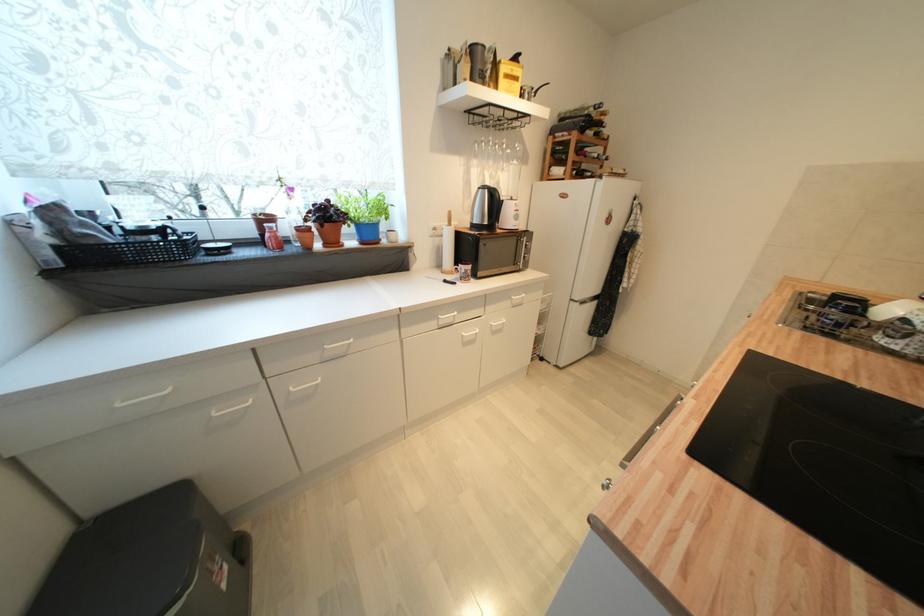
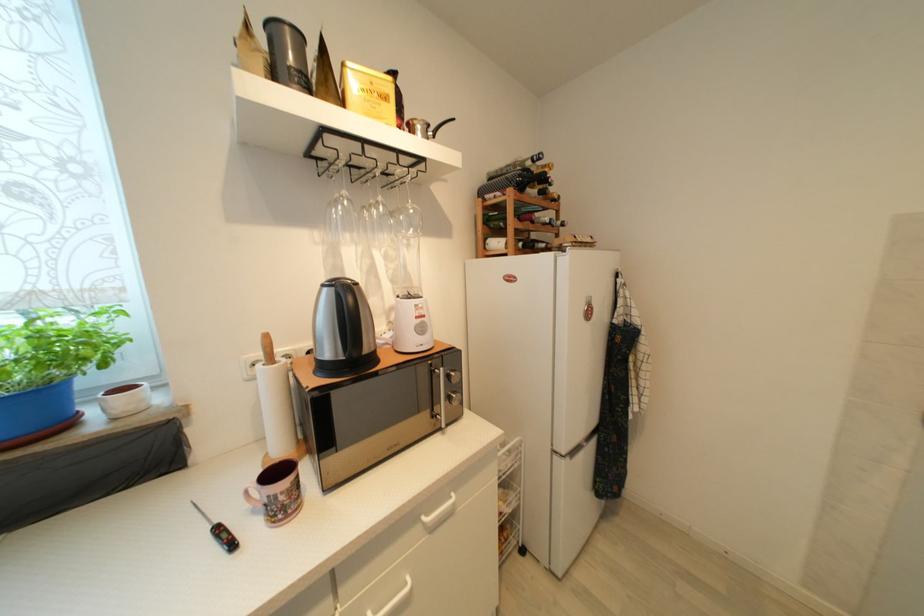
Where in the second image is the point corresponding to the point at 507,146 from the first image?

(383, 206)